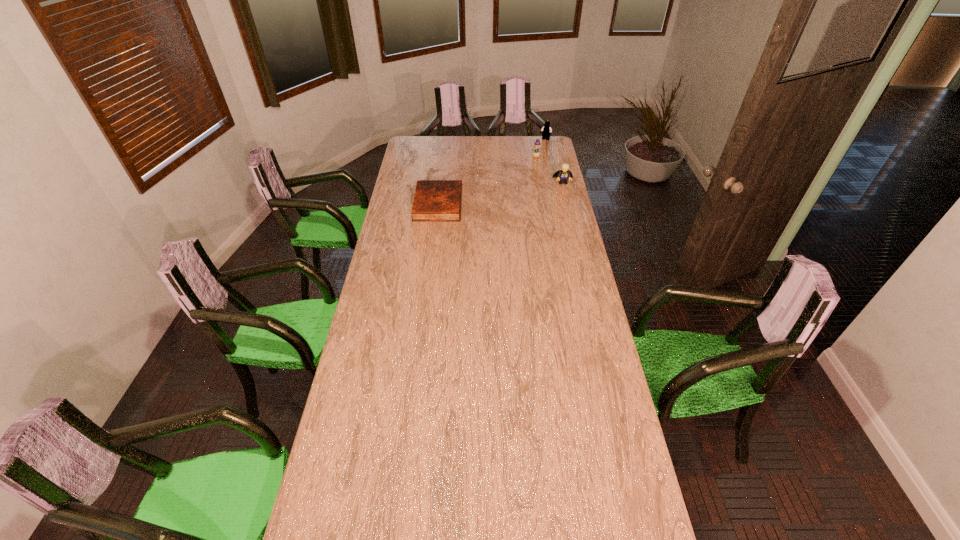
In order to click on Bible in this screenshot , I will do `click(435, 200)`.

You are a GUI agent. You are given a task and a screenshot of the screen. Output one action in this format:
    pyautogui.click(x=<x>, y=<y>)
    Task: Click on the leftmost object
    
    Given the screenshot: What is the action you would take?
    pyautogui.click(x=435, y=200)

Find the location of `the nearer Lego`. the nearer Lego is located at coordinates (563, 174).

This screenshot has height=540, width=960. I want to click on the second object from left to right, so click(536, 153).

This screenshot has height=540, width=960. I want to click on the second farthest object, so click(536, 153).

Locate an element on the screen. Image resolution: width=960 pixels, height=540 pixels. the farther Lego is located at coordinates (546, 129).

Find the location of a particular element. vacant position located 0.330m on the spine side of the Bible is located at coordinates (525, 204).

Where is `vacant area situated on the front-facing side of the nearer Lego`? The width and height of the screenshot is (960, 540). vacant area situated on the front-facing side of the nearer Lego is located at coordinates (572, 218).

Find the location of a particular element. free space located 0.070m on the face of the third object from right to left, where the monocle is placed is located at coordinates (529, 165).

The width and height of the screenshot is (960, 540). What are the coordinates of `free space located 0.150m on the face of the third object from right to left, where the monocle is placed` in the screenshot? It's located at pos(524,172).